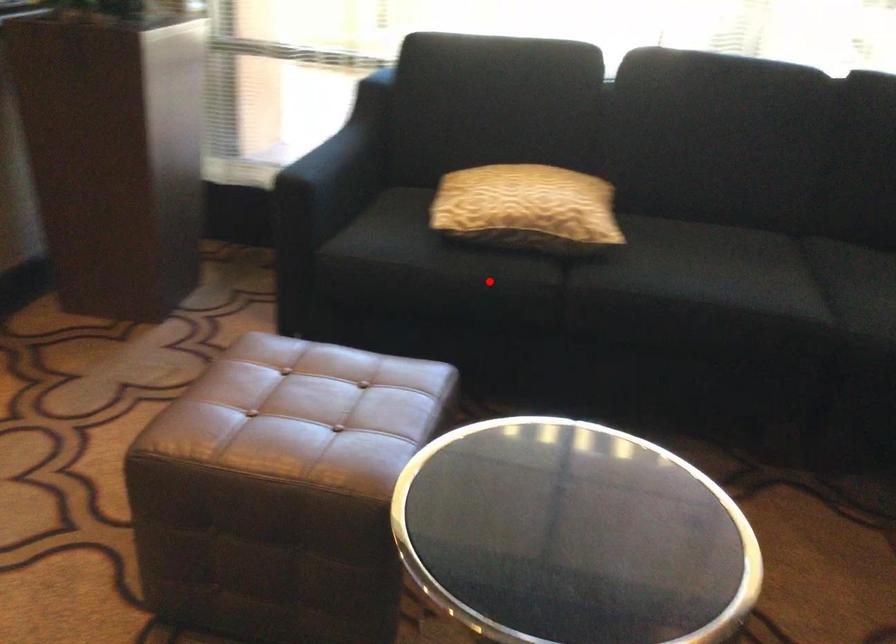
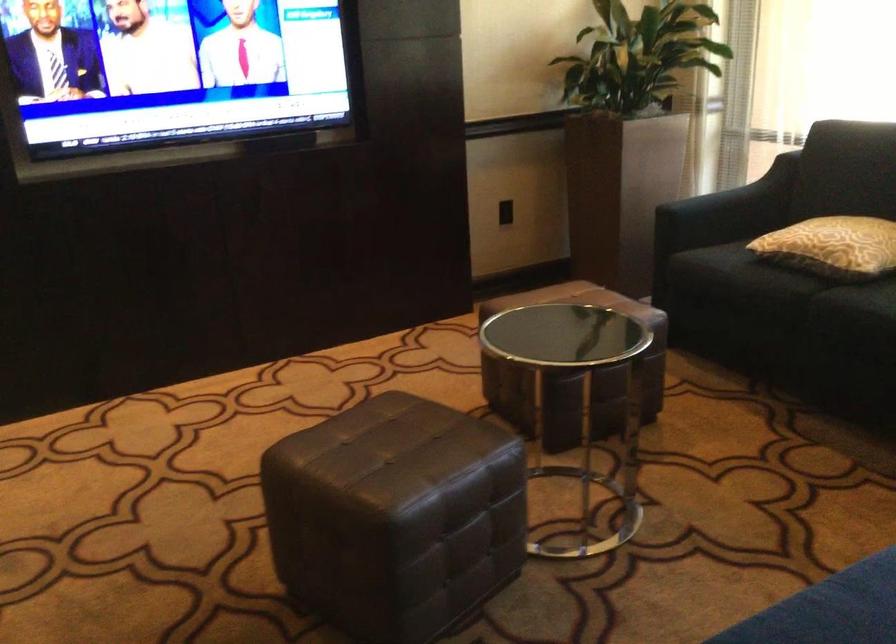
Question: I am providing you with two images of the same scene from different viewpoints. Given a red point in image1, look at the same physical point in image2. Is it:

Choices:
 (A) Closer to the viewpoint
 (B) Farther from the viewpoint

Answer: (B)